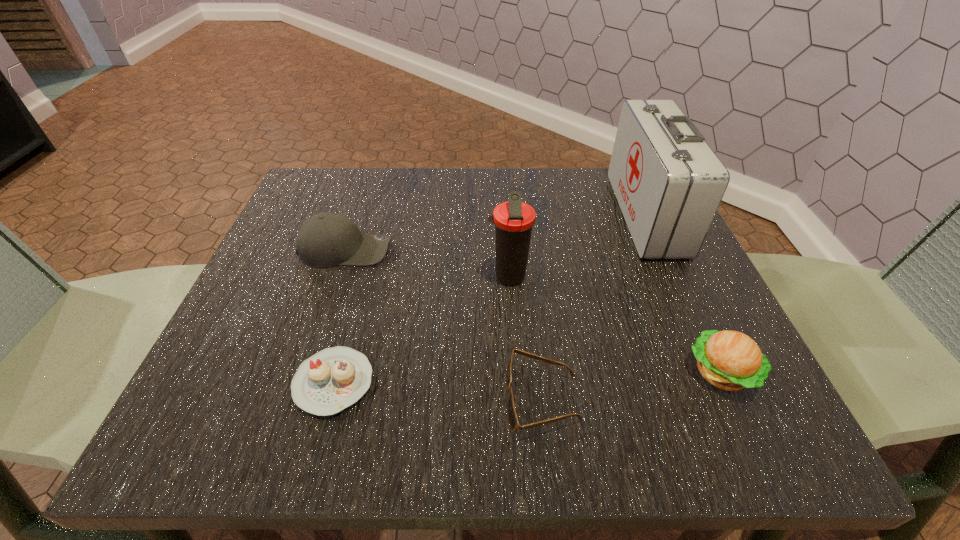
Locate an element on the screen. free location at the right edge of the desktop is located at coordinates (692, 367).

In the image, there is a desktop. Where is `vacant space at the far left corner`? This screenshot has height=540, width=960. vacant space at the far left corner is located at coordinates (352, 174).

This screenshot has height=540, width=960. I want to click on free space between the sunglasses and the cupcake, so click(x=438, y=391).

The width and height of the screenshot is (960, 540). I want to click on free space between the hamburger and the baseball cap, so click(x=534, y=311).

The height and width of the screenshot is (540, 960). In order to click on empty location between the cupcake and the hamburger in this screenshot , I will do `click(527, 377)`.

Where is `free space between the first-aid kit and the cupcake`? The image size is (960, 540). free space between the first-aid kit and the cupcake is located at coordinates (490, 298).

The height and width of the screenshot is (540, 960). What are the coordinates of `vacant space that's between the thermos bottle and the hamburger` in the screenshot? It's located at (614, 325).

This screenshot has width=960, height=540. I want to click on vacant point located between the hamburger and the cupcake, so click(x=527, y=377).

The width and height of the screenshot is (960, 540). Find the location of `unoccupied area between the sunglasses and the fifth shortest object`. unoccupied area between the sunglasses and the fifth shortest object is located at coordinates (525, 339).

I want to click on vacant space that is in between the hamburger and the sunglasses, so click(x=632, y=386).